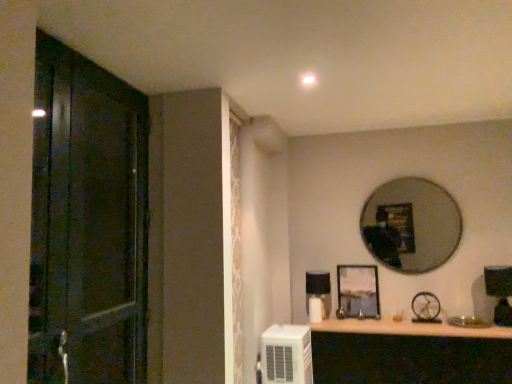
I want to click on free point below silver metallic mirror at upper right (from a real-world perspective), so click(x=417, y=319).